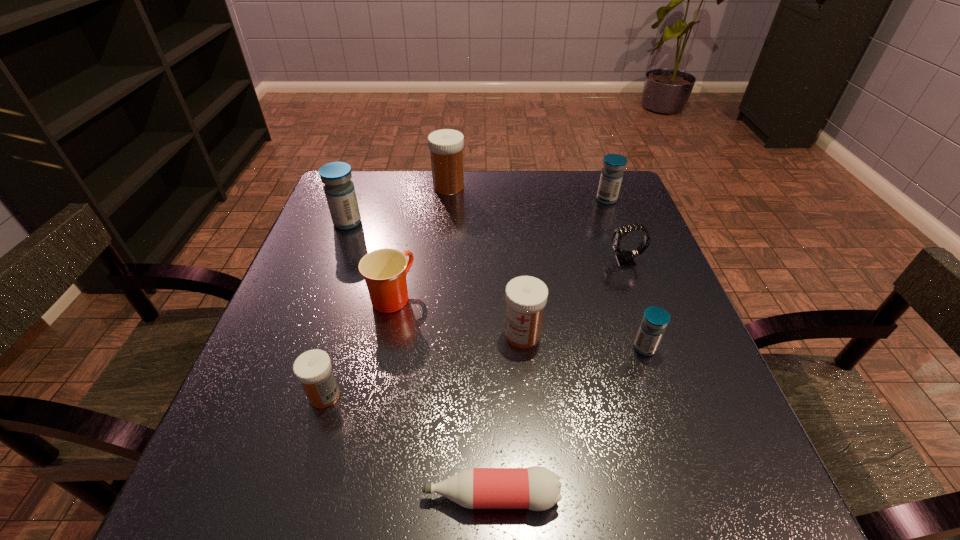
The image size is (960, 540). What are the coordinates of `the farthest white medicine` in the screenshot? It's located at (446, 146).

You are a GUI agent. You are given a task and a screenshot of the screen. Output one action in this format:
    pyautogui.click(x=<x>, y=<y>)
    Task: Click on the fourth medicine from right to left
    This screenshot has width=960, height=540.
    Given the screenshot: What is the action you would take?
    pyautogui.click(x=446, y=146)

Image resolution: width=960 pixels, height=540 pixels. Identify the location of the leftmost medicine. (339, 190).

You are a GUI agent. You are given a task and a screenshot of the screen. Output one action in this format:
    pyautogui.click(x=<x>, y=<y>)
    Task: Click on the biggest blue medicine
    Image resolution: width=960 pixels, height=540 pixels.
    Given the screenshot: What is the action you would take?
    pyautogui.click(x=339, y=190)

Find the location of a particular element. the second smallest blue medicine is located at coordinates (612, 173).

You are a GUI agent. You are given a task and a screenshot of the screen. Output one action in this format:
    pyautogui.click(x=<x>, y=<y>)
    Task: Click on the second farthest white medicine
    The image size is (960, 540).
    Given the screenshot: What is the action you would take?
    pyautogui.click(x=526, y=296)

Where is `the third medicine from right to left`? the third medicine from right to left is located at coordinates (526, 296).

You are a GUI agent. You are given a task and a screenshot of the screen. Output one action in this format:
    pyautogui.click(x=<x>, y=<y>)
    Task: Click on the third object from left to right
    The width and height of the screenshot is (960, 540).
    Given the screenshot: What is the action you would take?
    pos(384,270)

At what (x,y) coordinates should I click in order to perform the action: click on cup. Please return your answer as a coordinate pair (x, y). The width and height of the screenshot is (960, 540). Looking at the image, I should click on (384, 270).

The width and height of the screenshot is (960, 540). In order to click on the fourth farthest object in this screenshot , I will do `click(625, 258)`.